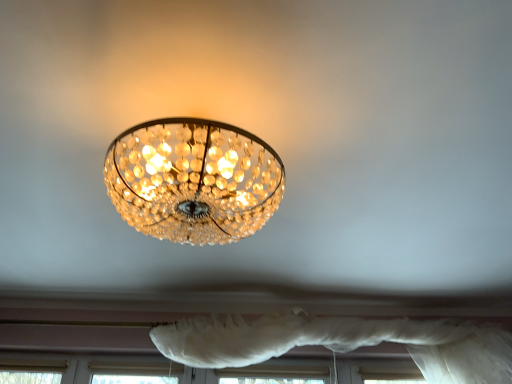
Question: Based on their sizes in the image, would you say translucent crystal chandelier at upper center is bigger or smaller than white sheer curtain at lower center?

Choices:
 (A) big
 (B) small

Answer: (B)

Question: In terms of width, does translucent crystal chandelier at upper center look wider or thinner when compared to white sheer curtain at lower center?

Choices:
 (A) thin
 (B) wide

Answer: (B)

Question: Do you think translucent crystal chandelier at upper center is within white sheer curtain at lower center, or outside of it?

Choices:
 (A) inside
 (B) outside

Answer: (B)

Question: Is white sheer curtain at lower center taller or shorter than translucent crystal chandelier at upper center?

Choices:
 (A) short
 (B) tall

Answer: (B)

Question: Considering the positions of point (414, 334) and point (199, 206), is point (414, 334) closer or farther from the camera than point (199, 206)?

Choices:
 (A) closer
 (B) farther

Answer: (B)

Question: In the image, is white sheer curtain at lower center positioned in front of or behind translucent crystal chandelier at upper center?

Choices:
 (A) behind
 (B) front

Answer: (A)

Question: Based on their sizes in the image, would you say white sheer curtain at lower center is bigger or smaller than translucent crystal chandelier at upper center?

Choices:
 (A) big
 (B) small

Answer: (A)